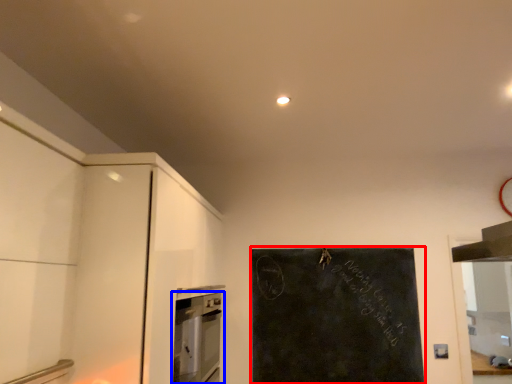
Question: Among these objects, which one is farthest to the camera, bulletin board (highlighted by a red box) or home appliance (highlighted by a blue box)?

Choices:
 (A) bulletin board
 (B) home appliance

Answer: (A)